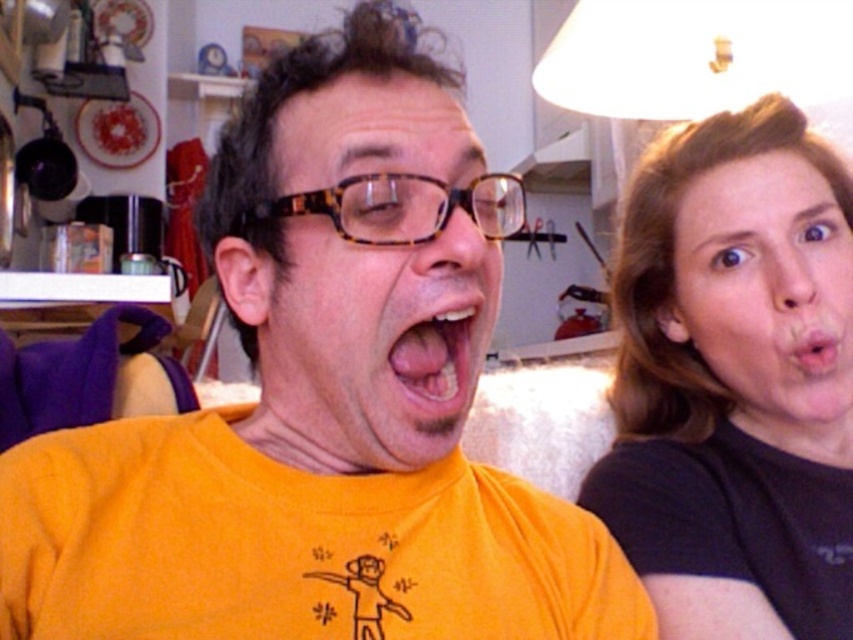
You are a photographer trying to capture a closeup shot of the black matte hair at upper right and the pink matte lips at upper right. Which object should you focus on first if you want to ensure both are in focus without adjusting the camera settings?

The black matte hair at upper right is larger in size than the pink matte lips at upper right, so focusing on the black matte hair at upper right first would help ensure both are in focus since it is the larger object and requires more precise focus.

You are a dental health expert evaluating the tongue position in the image. The pink glossy tongue at center is located at point coordinates of (437,353). Is this position within the standard range for a healthy tongue placement? Please explain your answer.

The standard range for a healthy tongue placement typically centers around the coordinates 0.5, 0.5. The pink glossy tongue at center at point coordinates (437,353) is slightly offset to the right and slightly forward compared to the ideal center. This deviation could indicate a minor misalignment but may still fall within acceptable limits depending on individual anatomical variations. Further evaluation by a professional would be needed for a definitive assessment.

From the picture: You are a dental professional assessing the spacing between the pink glossy tongue at center and the pink matte lips at upper right in the image. Given that the minimum safe distance for proper oral hygiene is 40 centimeters, is the current distance sufficient?

The pink glossy tongue at center is 40.43 centimeters away from the pink matte lips at upper right, which exceeds the minimum safe distance of 40 centimeters, so the current distance is sufficient for proper oral hygiene.